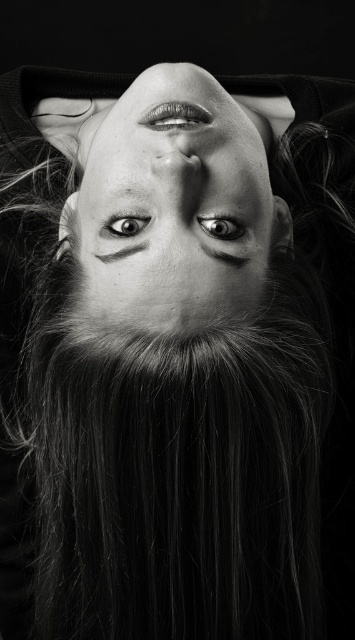
Based on the scene description, which object is wider, the smooth skin face at center or the shiny silver eye at center?

The smooth skin face at center is wider than the shiny silver eye at center according to the description.

What are the coordinates of the shiny black eye at center in the image?

The shiny black eye at center is located at coordinates point (221, 227).